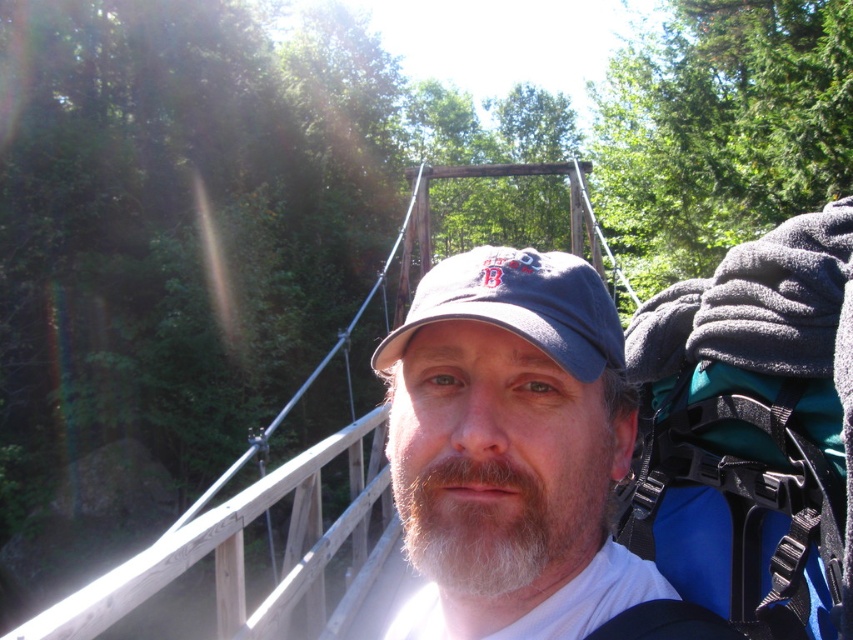
You are a photographer trying to capture the person on the wooden suspension bridge. You notice the white fuzzy beard at center. Where should you focus your camera to ensure the beard is in the frame?

You should focus your camera at point (503, 499) to capture the white fuzzy beard at center in the frame.

You are planning to take a photo of the person on the bridge. The gray fabric cap at center and the teal fabric backpack at upper right are both in the frame. Which object should you focus on to ensure the taller one is clearly visible?

The gray fabric cap at center is taller than the teal fabric backpack at upper right, so you should focus on the gray fabric cap at center to ensure the taller one is clearly visible.

The person in the image is wearing a gray fabric cap at center and has a white fuzzy beard at center. Which of these is positioned lower on their head?

The gray fabric cap at center is below the white fuzzy beard at center, so the gray fabric cap at center is positioned lower on their head.